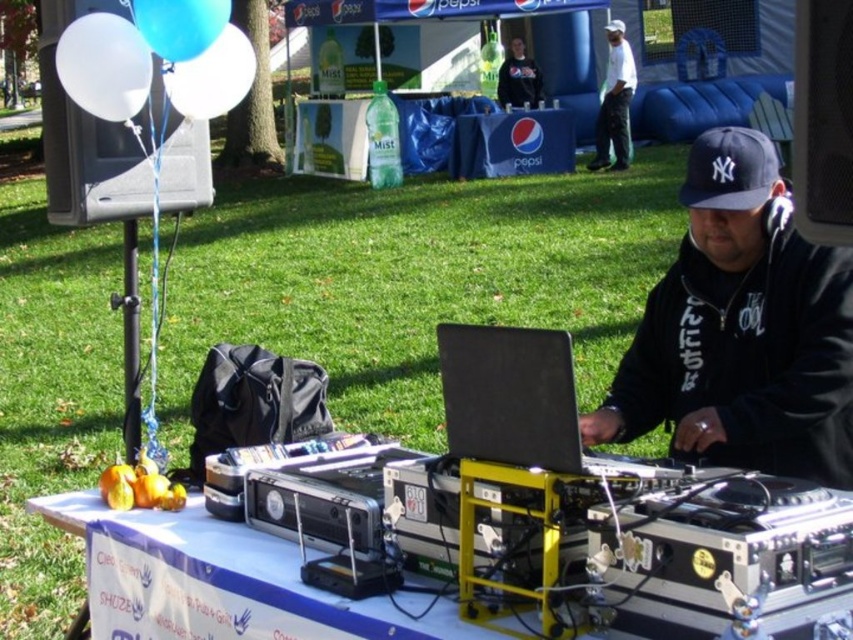
Question: Considering the real-world distances, which object is farthest from the metallic silver dj equipment at center?

Choices:
 (A) black fabric baseball cap at center
 (B) black leather jacket at center
 (C) white matte balloon at upper left
 (D) blue rubber balloon at upper left

Answer: (A)

Question: Considering the relative positions of black fabric baseball cap at center and blue rubber balloon at upper left in the image provided, where is black fabric baseball cap at center located with respect to blue rubber balloon at upper left?

Choices:
 (A) left
 (B) right

Answer: (B)

Question: Does white matte balloon at upper left lie in front of metallic silver dj equipment at center?

Choices:
 (A) no
 (B) yes

Answer: (A)

Question: Which point is farther to the camera?

Choices:
 (A) pyautogui.click(x=524, y=348)
 (B) pyautogui.click(x=677, y=196)
 (C) pyautogui.click(x=90, y=497)

Answer: (B)

Question: Is blue fabric pepsi banner at upper center above blue rubber balloon at upper left?

Choices:
 (A) no
 (B) yes

Answer: (B)

Question: Which point is farther from the camera taking this photo?

Choices:
 (A) (103, 81)
 (B) (769, 257)
 (C) (219, 6)
 (D) (624, 106)

Answer: (D)